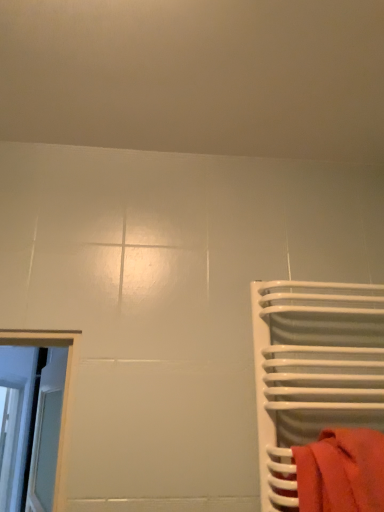
Measure the distance between white glossy towel rack at right and camera.

The distance of white glossy towel rack at right from camera is 38.03 inches.

At what (x,y) coordinates should I click in order to perform the action: click on white glossy towel rack at right. Please return your answer as a coordinate pair (x, y). The height and width of the screenshot is (512, 384). Looking at the image, I should click on (313, 371).

What do you see at coordinates (313, 371) in the screenshot? Image resolution: width=384 pixels, height=512 pixels. I see `white glossy towel rack at right` at bounding box center [313, 371].

Where is `matte red towel at right`? The image size is (384, 512). matte red towel at right is located at coordinates (341, 471).

This screenshot has height=512, width=384. What do you see at coordinates (341, 471) in the screenshot?
I see `matte red towel at right` at bounding box center [341, 471].

Image resolution: width=384 pixels, height=512 pixels. What are the coordinates of `white glossy towel rack at right` in the screenshot? It's located at (313, 371).

Can you confirm if matte red towel at right is positioned to the right of white glossy towel rack at right?

In fact, matte red towel at right is to the left of white glossy towel rack at right.

Between matte red towel at right and white glossy towel rack at right, which one is positioned in front?

matte red towel at right is in front.

Between point (326, 432) and point (259, 334), which one is positioned in front?

The point (326, 432) is in front.

From the image's perspective, is matte red towel at right under white glossy towel rack at right?

Indeed, from the image's perspective, matte red towel at right is shown beneath white glossy towel rack at right.

From a real-world perspective, is matte red towel at right physically located above or below white glossy towel rack at right?

In terms of real-world spatial position, matte red towel at right is below white glossy towel rack at right.

Between matte red towel at right and white glossy towel rack at right, which one has larger width?

white glossy towel rack at right is wider.

Does matte red towel at right have a lesser height compared to white glossy towel rack at right?

Yes.

Does matte red towel at right have a larger size compared to white glossy towel rack at right?

No, matte red towel at right is not bigger than white glossy towel rack at right.

Would you say matte red towel at right is outside white glossy towel rack at right?

Actually, matte red towel at right is within white glossy towel rack at right.

Are matte red towel at right and white glossy towel rack at right located far from each other?

No, there isn't a large distance between matte red towel at right and white glossy towel rack at right.

Is matte red towel at right oriented away from white glossy towel rack at right?

Absolutely, matte red towel at right is directed away from white glossy towel rack at right.

What's the angular difference between matte red towel at right and white glossy towel rack at right's facing directions?

2.76e-05 degrees.

This screenshot has width=384, height=512. In order to click on furniture lying behind the matte red towel at right in this screenshot , I will do `click(313, 371)`.

Which object is positioned more to the right, white glossy towel rack at right or matte red towel at right?

white glossy towel rack at right.

Between white glossy towel rack at right and matte red towel at right, which one is positioned in front?

matte red towel at right is in front.

Which point is more distant from viewer, (255,287) or (356,435)?

The point (255,287) is farther from the camera.

From the image's perspective, is white glossy towel rack at right located above matte red towel at right?

Yes.

From a real-world perspective, which object stands above the other?

In real-world perspective, white glossy towel rack at right is above.

Can you confirm if white glossy towel rack at right is wider than matte red towel at right?

Indeed, white glossy towel rack at right has a greater width compared to matte red towel at right.

Between white glossy towel rack at right and matte red towel at right, which one has less height?

Standing shorter between the two is matte red towel at right.

Who is smaller, white glossy towel rack at right or matte red towel at right?

With smaller size is matte red towel at right.

Is white glossy towel rack at right not within matte red towel at right?

Yes.

Can you see white glossy towel rack at right touching matte red towel at right?

white glossy towel rack at right and matte red towel at right are not in contact.

Is matte red towel at right at the back of white glossy towel rack at right?

Yes, white glossy towel rack at right is facing away from matte red towel at right.

I want to click on towel that is under the white glossy towel rack at right (from a real-world perspective), so click(341, 471).

Identify the location of furniture above the matte red towel at right (from the image's perspective). (313, 371).

Find the location of a particular element. towel that is below the white glossy towel rack at right (from the image's perspective) is located at coordinates (341, 471).